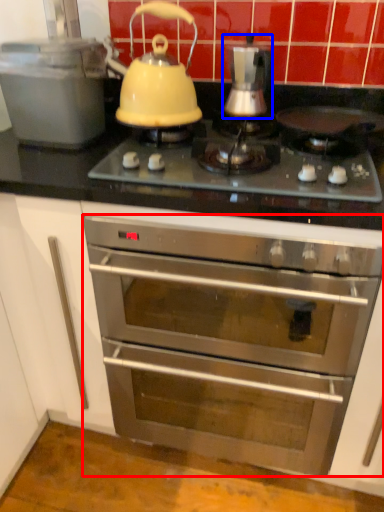
Question: Which object appears closest to the camera in this image, oven (highlighted by a red box) or kitchen appliance (highlighted by a blue box)?

Choices:
 (A) oven
 (B) kitchen appliance

Answer: (A)